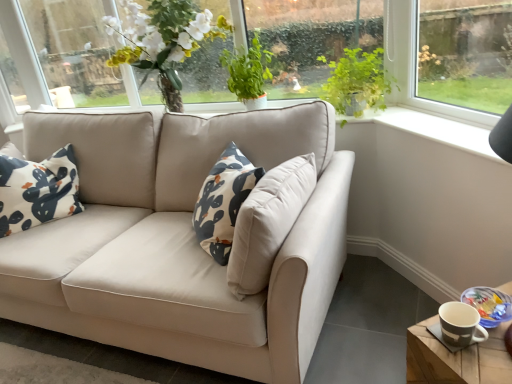
What do you see at coordinates (248, 72) in the screenshot? This screenshot has width=512, height=384. I see `green leafy plant at upper center, positioned as the second plant in right-to-left order` at bounding box center [248, 72].

Image resolution: width=512 pixels, height=384 pixels. What are the coordinates of `green leafy plant at upper center, marked as the first plant in a left-to-right arrangement` in the screenshot? It's located at (248, 72).

Describe the element at coordinates (357, 82) in the screenshot. The height and width of the screenshot is (384, 512). I see `green leafy plant at upper right, which appears as the 2th plant when viewed from the left` at that location.

What is the approximate height of wooden coaster at lower right?

The height of wooden coaster at lower right is 49.97 centimeters.

At what (x,y) coordinates should I click in order to perform the action: click on green leafy plant at upper center, marked as the first plant in a left-to-right arrangement. Please return your answer as a coordinate pair (x, y). The width and height of the screenshot is (512, 384). Looking at the image, I should click on (248, 72).

Is the position of clear glass window at upper right less distant than that of green leafy plant at upper center, marked as the first plant in a left-to-right arrangement?

Yes, clear glass window at upper right is in front of green leafy plant at upper center, marked as the first plant in a left-to-right arrangement.

Which of these two, clear glass window at upper right or green leafy plant at upper center, positioned as the second plant in right-to-left order, stands shorter?

Standing shorter between the two is green leafy plant at upper center, positioned as the second plant in right-to-left order.

Considering the relative positions of clear glass window at upper right and green leafy plant at upper center, marked as the first plant in a left-to-right arrangement, in the image provided, is clear glass window at upper right to the left or to the right of green leafy plant at upper center, marked as the first plant in a left-to-right arrangement,?

clear glass window at upper right is positioned on green leafy plant at upper center, marked as the first plant in a left-to-right arrangement,'s right side.

From a real-world perspective, is clear glass window at upper right above or below green leafy plant at upper center, positioned as the second plant in right-to-left order?

clear glass window at upper right is situated higher than green leafy plant at upper center, positioned as the second plant in right-to-left order, in the real world.

From the image's perspective, who appears lower, clear glass window at upper right or green leafy plant at upper right, the 1th plant in the right-to-left sequence?

green leafy plant at upper right, the 1th plant in the right-to-left sequence, from the image's perspective.

Visually, is clear glass window at upper right positioned to the left or to the right of green leafy plant at upper right, the 1th plant in the right-to-left sequence?

clear glass window at upper right is to the right of green leafy plant at upper right, the 1th plant in the right-to-left sequence.

Is green leafy plant at upper right, the 1th plant in the right-to-left sequence, at the back of clear glass window at upper right?

clear glass window at upper right is not turned away from green leafy plant at upper right, the 1th plant in the right-to-left sequence.

Looking at this image, which of these two, clear glass window at upper right or green leafy plant at upper right, the 1th plant in the right-to-left sequence, stands shorter?

green leafy plant at upper right, the 1th plant in the right-to-left sequence.

Is green leafy plant at upper right, the 1th plant in the right-to-left sequence, looking in the opposite direction of wooden coaster at lower right?

No.

Where is `table in front of the green leafy plant at upper right, which appears as the 2th plant when viewed from the left`? table in front of the green leafy plant at upper right, which appears as the 2th plant when viewed from the left is located at coordinates (456, 358).

Does green leafy plant at upper right, the 1th plant in the right-to-left sequence, have a larger size compared to wooden coaster at lower right?

Actually, green leafy plant at upper right, the 1th plant in the right-to-left sequence, might be smaller than wooden coaster at lower right.

Is green leafy plant at upper right, the 1th plant in the right-to-left sequence, surrounding wooden coaster at lower right?

No, green leafy plant at upper right, the 1th plant in the right-to-left sequence, does not contain wooden coaster at lower right.

From a real-world perspective, which is physically below, green leafy plant at upper center, positioned as the second plant in right-to-left order, or clear glass window at upper right?

green leafy plant at upper center, positioned as the second plant in right-to-left order, from a real-world perspective.

Which object is more forward, green leafy plant at upper center, positioned as the second plant in right-to-left order, or clear glass window at upper right?

clear glass window at upper right is closer to the camera.

Does green leafy plant at upper center, marked as the first plant in a left-to-right arrangement, have a greater height compared to clear glass window at upper right?

In fact, green leafy plant at upper center, marked as the first plant in a left-to-right arrangement, may be shorter than clear glass window at upper right.

Can you confirm if green leafy plant at upper center, positioned as the second plant in right-to-left order, is thinner than clear glass window at upper right?

No, green leafy plant at upper center, positioned as the second plant in right-to-left order, is not thinner than clear glass window at upper right.

The width and height of the screenshot is (512, 384). Find the location of `coffee cup to the right of green leafy plant at upper center, positioned as the second plant in right-to-left order`. coffee cup to the right of green leafy plant at upper center, positioned as the second plant in right-to-left order is located at coordinates (460, 324).

From the image's perspective, which one is positioned higher, matte brown mug at lower right or green leafy plant at upper center, positioned as the second plant in right-to-left order?

green leafy plant at upper center, positioned as the second plant in right-to-left order.

From their relative heights in the image, would you say matte brown mug at lower right is taller or shorter than green leafy plant at upper center, positioned as the second plant in right-to-left order?

matte brown mug at lower right is shorter than green leafy plant at upper center, positioned as the second plant in right-to-left order.

From the picture: Based on their sizes in the image, would you say matte brown mug at lower right is bigger or smaller than green leafy plant at upper center, marked as the first plant in a left-to-right arrangement?

Clearly, matte brown mug at lower right is smaller in size than green leafy plant at upper center, marked as the first plant in a left-to-right arrangement.

From the image's perspective, which is above, wooden coaster at lower right or green leafy plant at upper center, positioned as the second plant in right-to-left order?

From the image's view, green leafy plant at upper center, positioned as the second plant in right-to-left order, is above.

Is wooden coaster at lower right positioned with its back to green leafy plant at upper center, positioned as the second plant in right-to-left order?

wooden coaster at lower right does not have its back to green leafy plant at upper center, positioned as the second plant in right-to-left order.

Considering the relative sizes of wooden coaster at lower right and green leafy plant at upper center, marked as the first plant in a left-to-right arrangement, in the image provided, is wooden coaster at lower right smaller than green leafy plant at upper center, marked as the first plant in a left-to-right arrangement,?

No, wooden coaster at lower right is not smaller than green leafy plant at upper center, marked as the first plant in a left-to-right arrangement.

Does wooden coaster at lower right have a greater width compared to green leafy plant at upper center, marked as the first plant in a left-to-right arrangement?

Yes.

From the picture: Considering the relative sizes of green leafy plant at upper center, positioned as the second plant in right-to-left order, and wooden coaster at lower right in the image provided, is green leafy plant at upper center, positioned as the second plant in right-to-left order, bigger than wooden coaster at lower right?

No, green leafy plant at upper center, positioned as the second plant in right-to-left order, is not bigger than wooden coaster at lower right.

From the image's perspective, does green leafy plant at upper center, positioned as the second plant in right-to-left order, appear higher than wooden coaster at lower right?

Yes.

Is green leafy plant at upper center, marked as the first plant in a left-to-right arrangement, in front of or behind wooden coaster at lower right in the image?

Clearly, green leafy plant at upper center, marked as the first plant in a left-to-right arrangement, is behind wooden coaster at lower right.

Can you confirm if green leafy plant at upper center, positioned as the second plant in right-to-left order, is thinner than wooden coaster at lower right?

Yes.

At what (x,y) coordinates should I click in order to perform the action: click on window in front of the green leafy plant at upper center, positioned as the second plant in right-to-left order. Please return your answer as a coordinate pair (x, y). The height and width of the screenshot is (384, 512). Looking at the image, I should click on (466, 53).

Locate an element on the screen. The image size is (512, 384). plant lying below the clear glass window at upper right (from the image's perspective) is located at coordinates (357, 82).

From the image, which object appears to be farther from wooden coaster at lower right, matte brown mug at lower right or clear glass window at upper right?

clear glass window at upper right is further to wooden coaster at lower right.

From the image, which object appears to be farther from clear glass window at upper right, green leafy plant at upper right, the 1th plant in the right-to-left sequence, or green leafy plant at upper center, positioned as the second plant in right-to-left order?

The object further to clear glass window at upper right is green leafy plant at upper center, positioned as the second plant in right-to-left order.

Considering their positions, is green leafy plant at upper center, positioned as the second plant in right-to-left order, positioned closer to wooden coaster at lower right than matte brown mug at lower right?

Among the two, matte brown mug at lower right is located nearer to wooden coaster at lower right.

Estimate the real-world distances between objects in this image. Which object is further from green leafy plant at upper center, marked as the first plant in a left-to-right arrangement, clear glass window at upper right or green leafy plant at upper right, the 1th plant in the right-to-left sequence?

Among the two, clear glass window at upper right is located further to green leafy plant at upper center, marked as the first plant in a left-to-right arrangement.

Based on the photo, considering their positions, is wooden coaster at lower right positioned closer to green leafy plant at upper center, marked as the first plant in a left-to-right arrangement, than clear glass window at upper right?

clear glass window at upper right lies closer to green leafy plant at upper center, marked as the first plant in a left-to-right arrangement, than the other object.

Estimate the real-world distances between objects in this image. Which object is closer to matte brown mug at lower right, green leafy plant at upper center, positioned as the second plant in right-to-left order, or green leafy plant at upper right, which appears as the 2th plant when viewed from the left?

The object closer to matte brown mug at lower right is green leafy plant at upper right, which appears as the 2th plant when viewed from the left.

Looking at the image, which one is located further to green leafy plant at upper right, which appears as the 2th plant when viewed from the left, wooden coaster at lower right or matte brown mug at lower right?

wooden coaster at lower right.

From the image, which object appears to be farther from matte brown mug at lower right, green leafy plant at upper center, positioned as the second plant in right-to-left order, or wooden coaster at lower right?

Based on the image, green leafy plant at upper center, positioned as the second plant in right-to-left order, appears to be further to matte brown mug at lower right.

Where is `coffee cup that lies between green leafy plant at upper center, marked as the first plant in a left-to-right arrangement, and wooden coaster at lower right from top to bottom`? This screenshot has width=512, height=384. coffee cup that lies between green leafy plant at upper center, marked as the first plant in a left-to-right arrangement, and wooden coaster at lower right from top to bottom is located at coordinates (460, 324).

Find the location of a particular element. window between green leafy plant at upper center, positioned as the second plant in right-to-left order, and wooden coaster at lower right from top to bottom is located at coordinates (466, 53).

Locate an element on the screen. Image resolution: width=512 pixels, height=384 pixels. plant between clear glass window at upper right and wooden coaster at lower right in the up-down direction is located at coordinates (357, 82).

This screenshot has width=512, height=384. I want to click on plant between green leafy plant at upper center, positioned as the second plant in right-to-left order, and matte brown mug at lower right from top to bottom, so click(x=357, y=82).